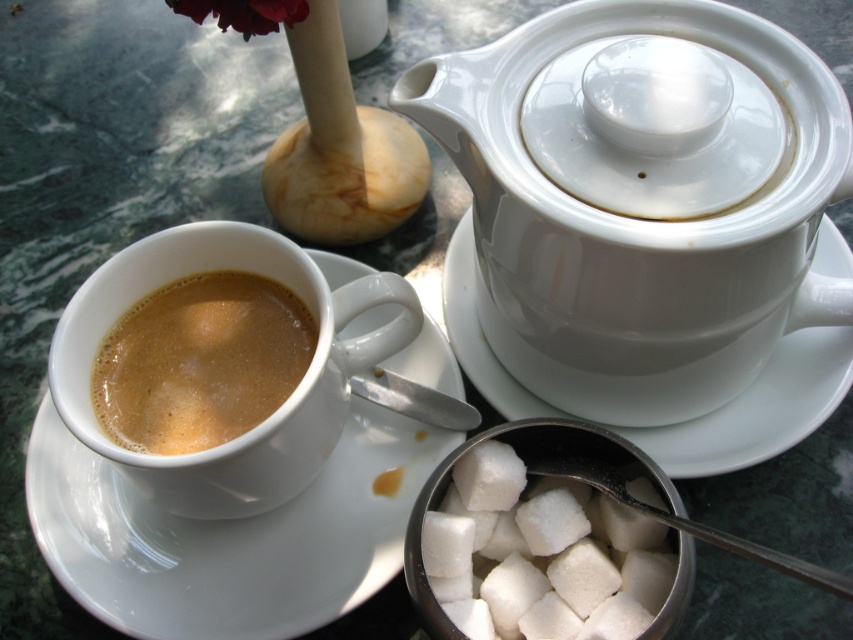
Question: Is white ceramic saucer at left below white ceramic saucer at center?

Choices:
 (A) yes
 (B) no

Answer: (A)

Question: Which point appears closest to the camera in this image?

Choices:
 (A) (654, 112)
 (B) (837, 337)
 (C) (535, 547)

Answer: (A)

Question: Does white glossy teapot at upper center have a lesser width compared to white ceramic saucer at center?

Choices:
 (A) no
 (B) yes

Answer: (B)

Question: Is white ceramic saucer at left to the left of silver metallic spoon at center from the viewer's perspective?

Choices:
 (A) no
 (B) yes

Answer: (B)

Question: Which of these objects is positioned closest to the white ceramic saucer at center?

Choices:
 (A) brown matte cup at lower left
 (B) white sugar cubes at center
 (C) white glossy teapot at upper center

Answer: (C)

Question: Which object appears farthest from the camera in this image?

Choices:
 (A) white glossy teapot at upper center
 (B) white ceramic saucer at center
 (C) white sugar cubes at center
 (D) brown matte cup at lower left

Answer: (B)